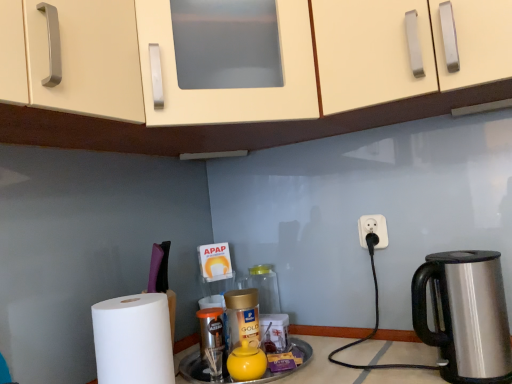
Question: From a real-world perspective, relative to gold metallic jar at center, the first bottle in the back-to-front sequence, is stainless steel kettle at right vertically above or below?

Choices:
 (A) below
 (B) above

Answer: (B)

Question: Looking at their shapes, would you say stainless steel kettle at right is wider or thinner than gold metallic jar at center, positioned as the 2th bottle in front-to-back order?

Choices:
 (A) thin
 (B) wide

Answer: (B)

Question: Considering the real-world distances, which object is farthest from the gold metallic jar at center, positioned as the 2th bottle in front-to-back order?

Choices:
 (A) stainless steel kettle at right
 (B) matte cream cabinet at upper center
 (C) white plastic power outlet at right
 (D) white matte paper towel at lower left
 (E) gold plastic bottle at center, which is the second bottle in back-to-front order

Answer: (B)

Question: Which object is positioned closest to the yellow matte tea pot at center?

Choices:
 (A) matte cream cabinet at upper center
 (B) gold metallic jar at center, the first bottle in the back-to-front sequence
 (C) stainless steel kettle at right
 (D) white plastic power outlet at right
 (E) white matte paper towel at lower left

Answer: (E)